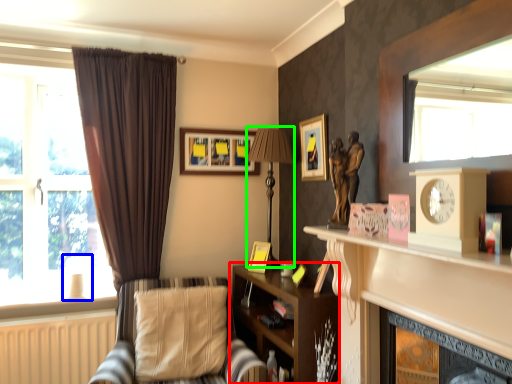
Question: Estimate the real-world distances between objects in this image. Which object is closer to shelf (highlighted by a red box), lamp (highlighted by a blue box) or lamp (highlighted by a green box)?

Choices:
 (A) lamp
 (B) lamp

Answer: (B)